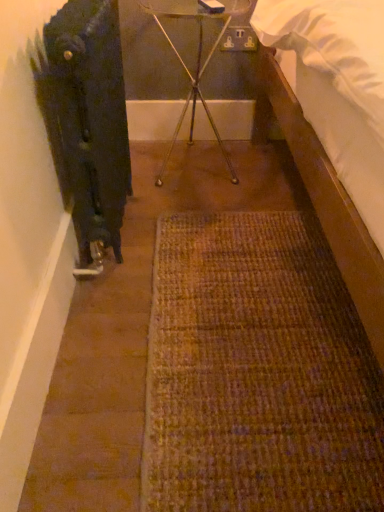
Question: Considering their positions, is metallic tripod at center located in front of or behind black matte radiator at left?

Choices:
 (A) behind
 (B) front

Answer: (A)

Question: Does point (188, 93) appear closer or farther from the camera than point (97, 226)?

Choices:
 (A) closer
 (B) farther

Answer: (B)

Question: From a real-world perspective, relative to black matte radiator at left, is metallic tripod at center vertically above or below?

Choices:
 (A) above
 (B) below

Answer: (B)

Question: Based on their sizes in the image, would you say black matte radiator at left is bigger or smaller than metallic tripod at center?

Choices:
 (A) big
 (B) small

Answer: (B)

Question: From the image's perspective, relative to metallic tripod at center, is black matte radiator at left above or below?

Choices:
 (A) below
 (B) above

Answer: (A)

Question: From a real-world perspective, is black matte radiator at left positioned above or below metallic tripod at center?

Choices:
 (A) below
 (B) above

Answer: (B)

Question: Looking at their shapes, would you say black matte radiator at left is wider or thinner than metallic tripod at center?

Choices:
 (A) thin
 (B) wide

Answer: (A)